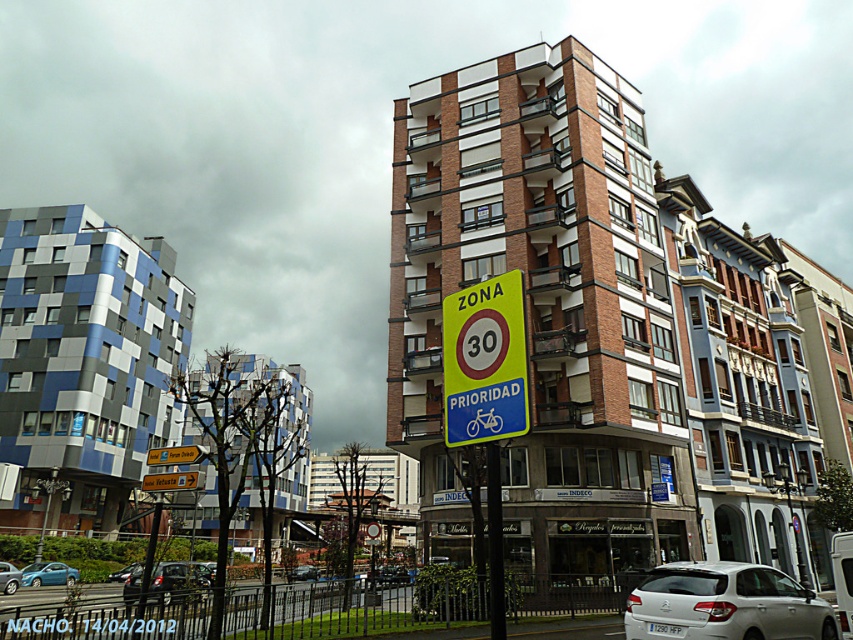
Is white matte car at lower right bigger than metallic silver car at center?

Actually, white matte car at lower right might be smaller than metallic silver car at center.

Is white matte car at lower right below metallic silver car at center?

No.

Where is `white matte car at lower right`? This screenshot has height=640, width=853. white matte car at lower right is located at coordinates (724, 604).

Who is more distant from viewer, (163, 445) or (15, 580)?

The point (163, 445) is behind.

Does yellow plastic sign at upper center have a smaller size compared to matte blue car at center?

No, yellow plastic sign at upper center is not smaller than matte blue car at center.

Which is behind, point (160, 464) or point (16, 582)?

Point (16, 582)

At what (x,y) coordinates should I click in order to perform the action: click on yellow plastic sign at upper center. Please return your answer as a coordinate pair (x, y). This screenshot has width=853, height=640. Looking at the image, I should click on (175, 456).

Between silver metallic car at center and metallic silver car at center, which one appears on the left side from the viewer's perspective?

Positioned to the left is metallic silver car at center.

Image resolution: width=853 pixels, height=640 pixels. Describe the element at coordinates (387, 573) in the screenshot. I see `silver metallic car at center` at that location.

The image size is (853, 640). Find the location of `silver metallic car at center`. silver metallic car at center is located at coordinates (387, 573).